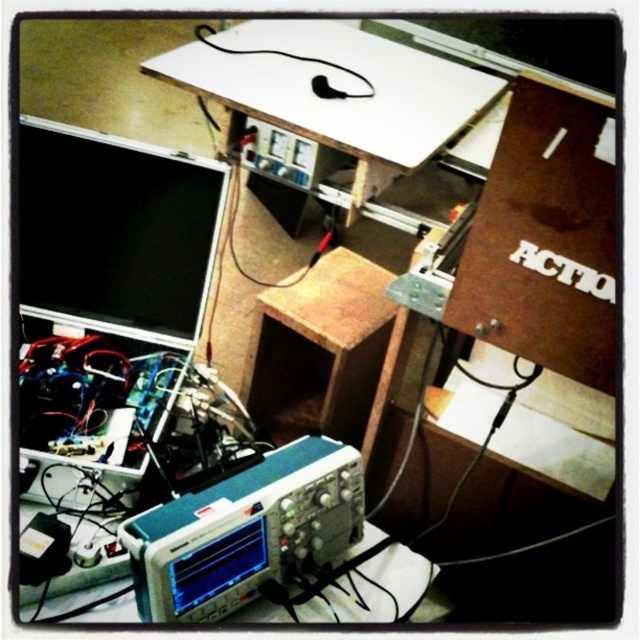
Question: Can you confirm if black matte computer monitor at upper left is thinner than blue metallic oscilloscope at center?

Choices:
 (A) yes
 (B) no

Answer: (B)

Question: Is blue metallic oscilloscope at center further to the viewer compared to black rubber wire at upper center?

Choices:
 (A) no
 (B) yes

Answer: (A)

Question: Which object appears farthest from the camera in this image?

Choices:
 (A) blue metallic oscilloscope at center
 (B) black rubber wire at upper center

Answer: (B)

Question: Estimate the real-world distances between objects in this image. Which object is closer to the black rubber wire at upper center?

Choices:
 (A) black matte computer monitor at upper left
 (B) blue metallic oscilloscope at center
 (C) white plastic table at upper center

Answer: (C)

Question: In this image, where is black matte computer monitor at upper left located relative to blue metallic oscilloscope at center?

Choices:
 (A) right
 (B) left

Answer: (B)

Question: Considering the real-world distances, which object is farthest from the black rubber wire at upper center?

Choices:
 (A) blue metallic oscilloscope at center
 (B) black matte computer monitor at upper left
 (C) white plastic table at upper center

Answer: (A)